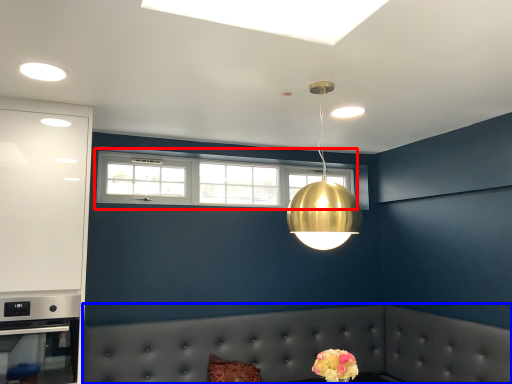
Question: Which object is closer to the camera taking this photo, window (highlighted by a red box) or couch (highlighted by a blue box)?

Choices:
 (A) window
 (B) couch

Answer: (B)